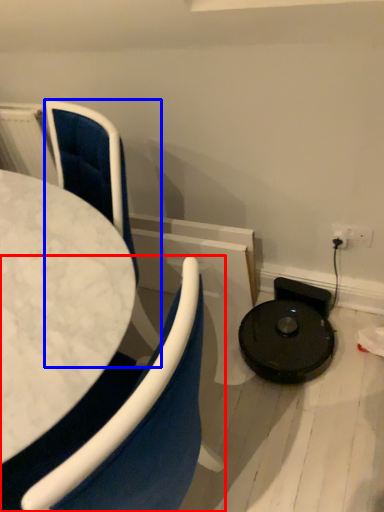
Question: Which object appears farthest to the camera in this image, chair (highlighted by a red box) or chair (highlighted by a blue box)?

Choices:
 (A) chair
 (B) chair

Answer: (B)